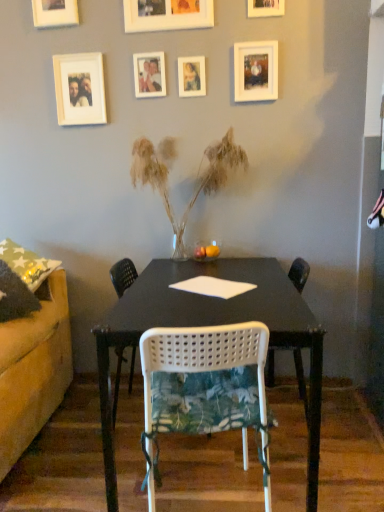
The image size is (384, 512). In order to click on empty space that is ontop of green floral fabric chair at center, which is counted as the second chair, starting from the back (from a real-world perspective) in this screenshot , I will do `click(208, 393)`.